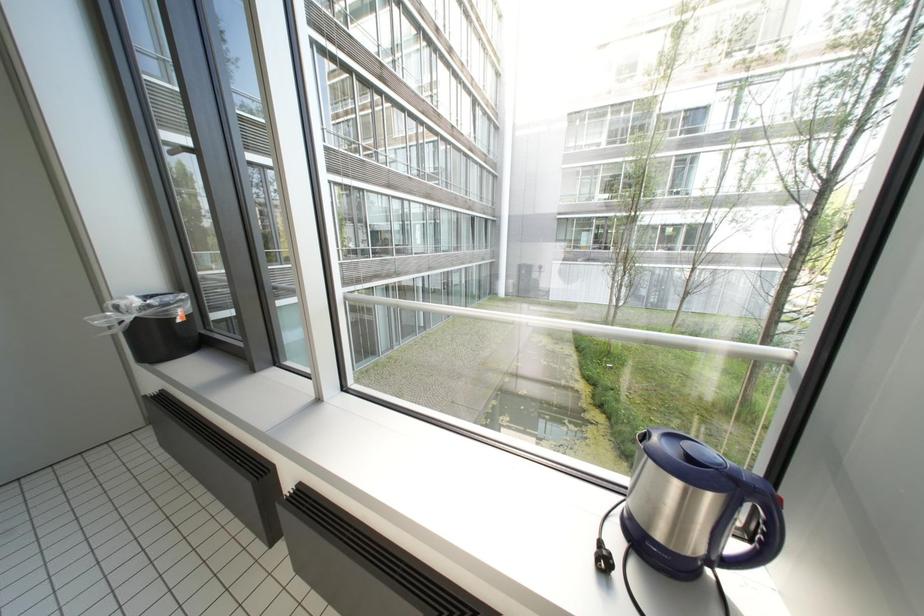
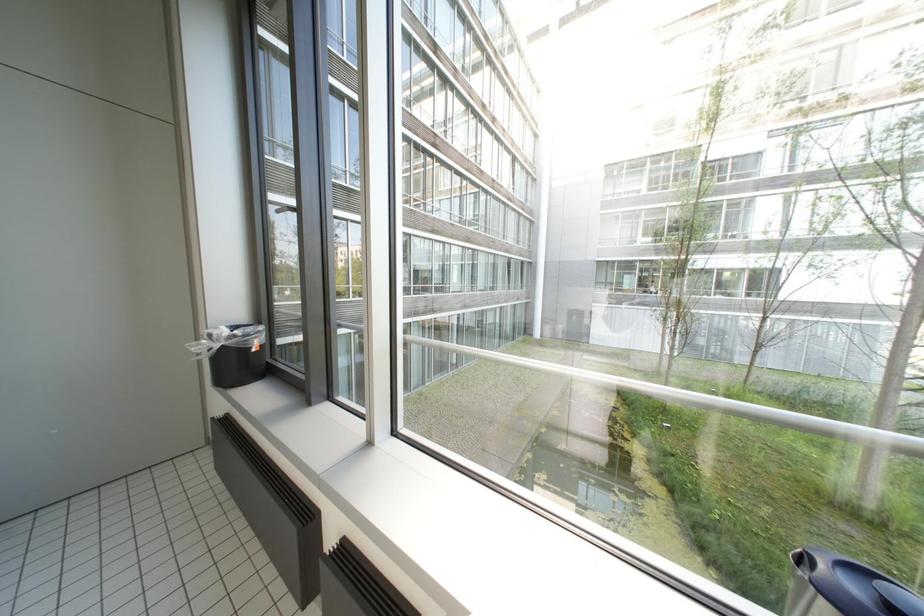
Question: In a continuous first-person perspective shot, in which direction is the camera moving?

Choices:
 (A) Left
 (B) Right
 (C) Forward
 (D) Backward

Answer: (A)